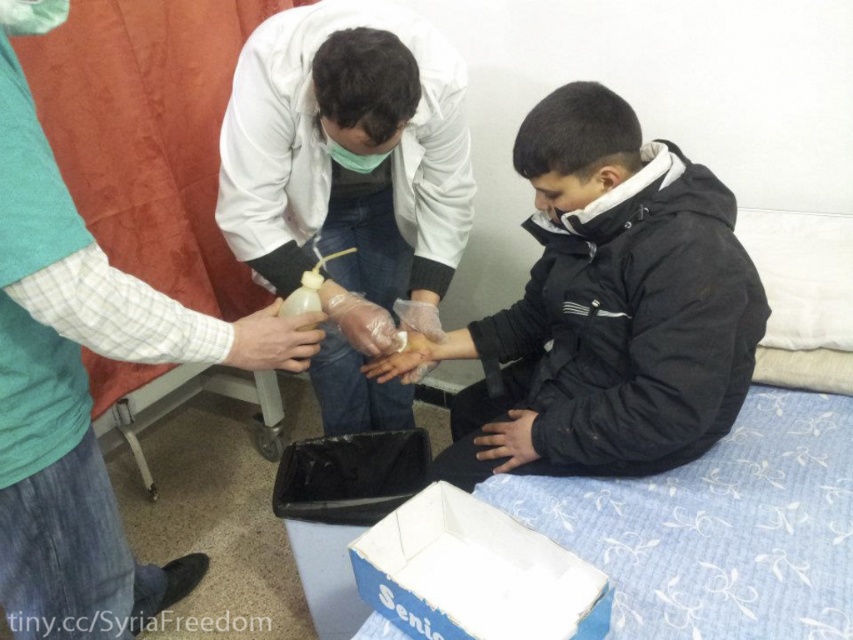
In the medical scene, there is a black matte jacket at center and a blue cardboard box at lower center. From the perspective of the seated person, which object is closer to them?

The black matte jacket at center is closer to the seated person because the blue cardboard box at lower center is positioned behind it.

In the scene, there is a blue cardboard box at lower center and a point marked at coordinates (x=474, y=573). Is the point located on the blue cardboard box at lower center?

Yes, the point marked at coordinates (x=474, y=573) is located on the blue cardboard box at lower center according to the description.